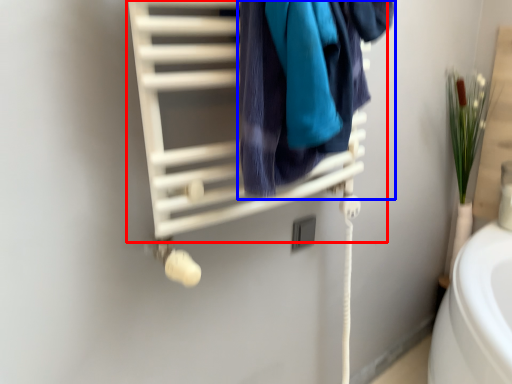
Question: Which object is closer to the camera taking this photo, closet (highlighted by a red box) or towel (highlighted by a blue box)?

Choices:
 (A) closet
 (B) towel

Answer: (A)